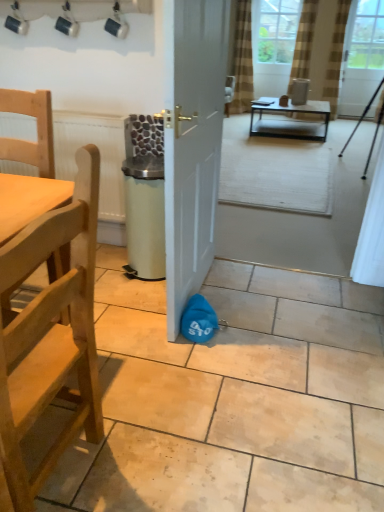
Question: In terms of width, does white glossy door at center look wider or thinner when compared to wooden chair at left, placed as the second chair when sorted from top to bottom?

Choices:
 (A) wide
 (B) thin

Answer: (B)

Question: Is white glossy door at center inside or outside of wooden chair at left, placed as the first chair when sorted from bottom to top?

Choices:
 (A) inside
 (B) outside

Answer: (B)

Question: Which object is the closest to the white glossy door at center?

Choices:
 (A) brown textured curtain at upper right, marked as the third curtain in a left-to-right arrangement
 (B) brown striped curtain at upper center, which appears as the 1th curtain when viewed from the left
 (C) wooden chair at left, placed as the second chair when sorted from top to bottom
 (D) clear glass door at upper right, which is counted as the 1th window screen, starting from the right
 (E) clear glass window screen at upper center, which is the first window screen in left-to-right order

Answer: (C)

Question: Which object is positioned farthest from the metallic black coffee table at center?

Choices:
 (A) clear glass window screen at upper center, acting as the second window screen starting from the right
 (B) white glossy door at center
 (C) wooden chair at left, placed as the first chair when sorted from bottom to top
 (D) light wood/rough chair at left, which is the 2th chair in bottom-to-top order
 (E) brown textured curtain at upper right, which ranks as the 1th curtain in right-to-left order

Answer: (C)